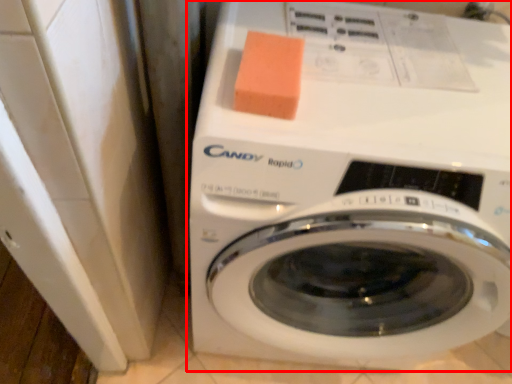
Question: Where is washing machine (annotated by the red box) located in relation to soap in the image?

Choices:
 (A) left
 (B) right

Answer: (B)